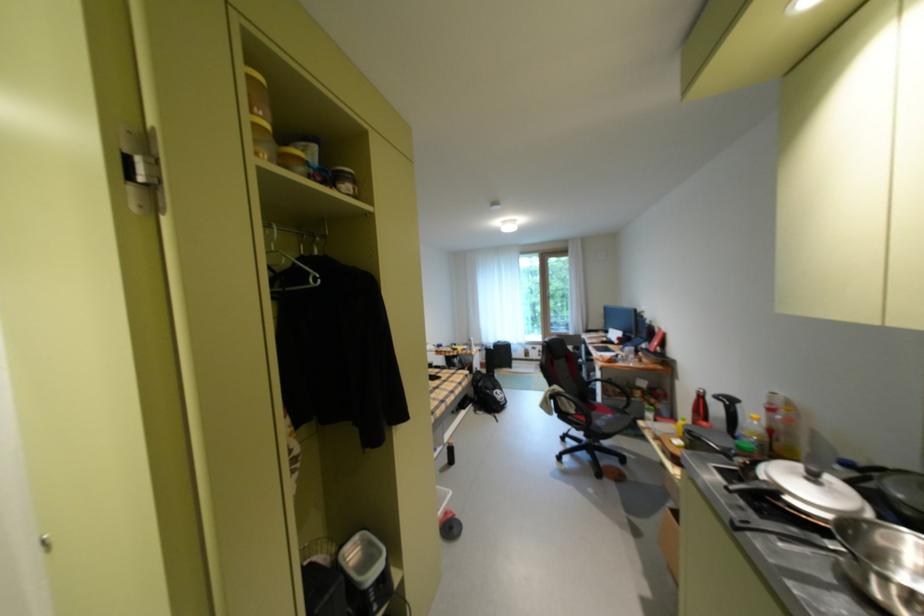
This screenshot has width=924, height=616. Describe the element at coordinates (883, 562) in the screenshot. I see `the silver metal bowl` at that location.